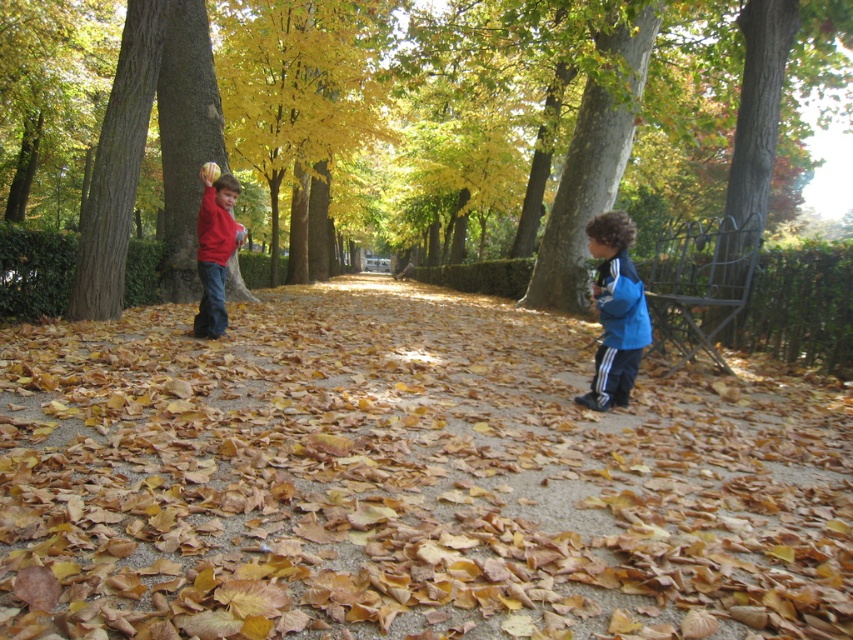
Can you confirm if blue fleece jacket at right is taller than matte red sweater at left?

No, blue fleece jacket at right is not taller than matte red sweater at left.

Which is more to the right, blue fleece jacket at right or matte red sweater at left?

Positioned to the right is blue fleece jacket at right.

Is point (618, 211) behind point (222, 317)?

Yes.

This screenshot has width=853, height=640. Find the location of `blue fleece jacket at right`. blue fleece jacket at right is located at coordinates (614, 310).